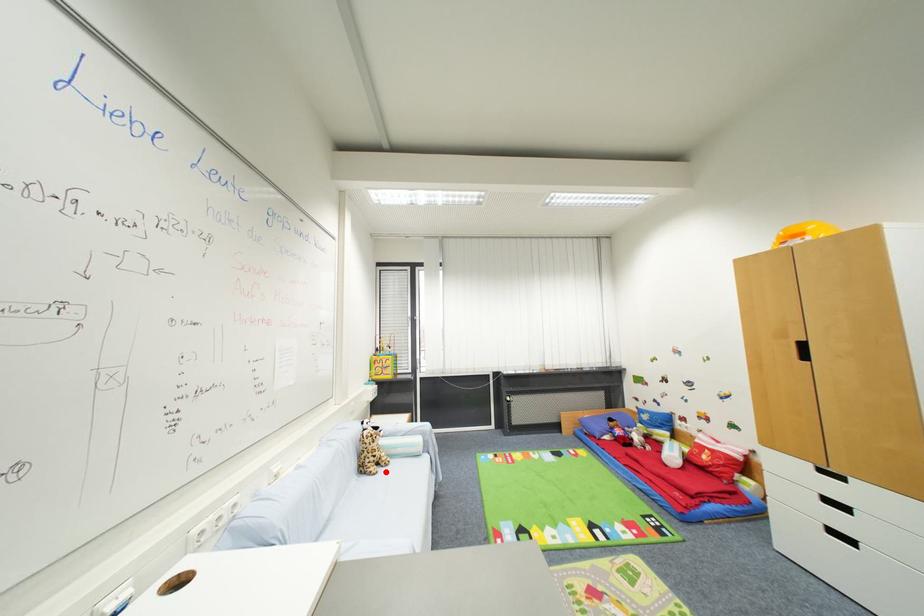
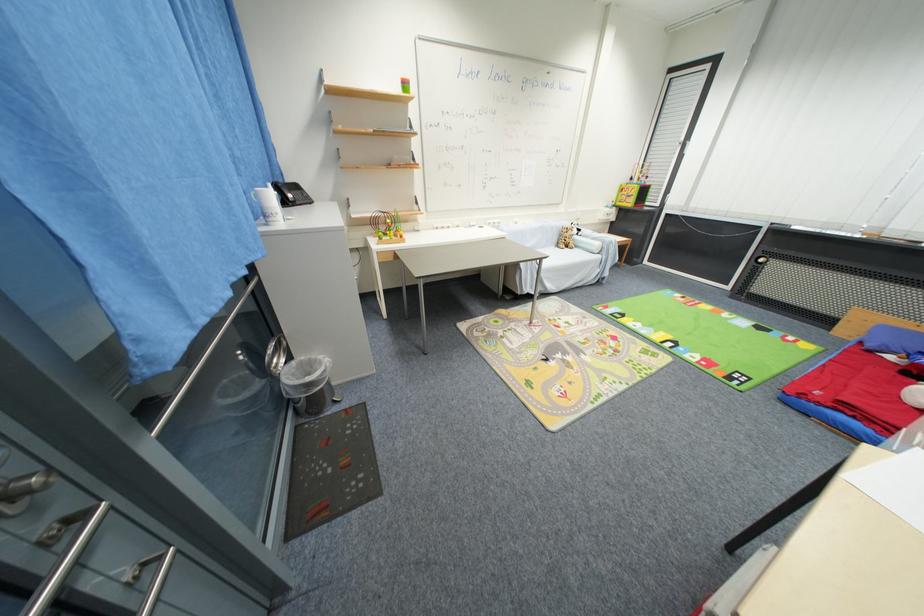
Find the pixel in the second image that matches the highlighted location in the first image.

(572, 251)